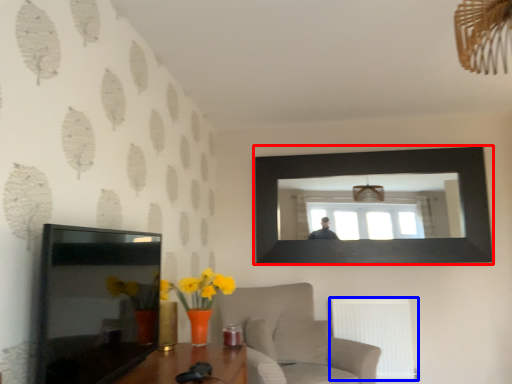
Question: Which object appears farthest to the camera in this image, picture frame (highlighted by a red box) or radiator (highlighted by a blue box)?

Choices:
 (A) picture frame
 (B) radiator

Answer: (A)